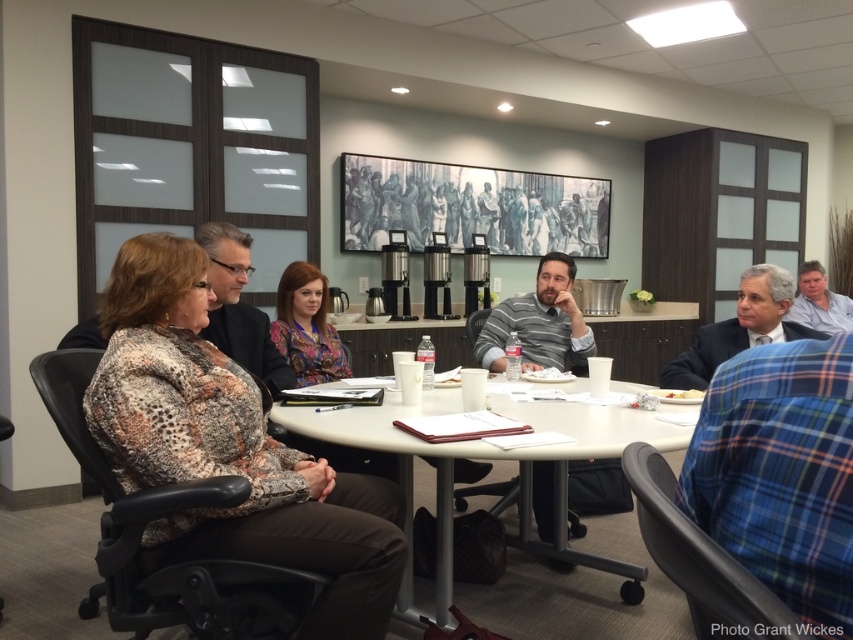
Question: Can you confirm if printed fabric blouse at left is smaller than gray striped shirt at center?

Choices:
 (A) no
 (B) yes

Answer: (A)

Question: In this image, where is printed fabric blouse at left located relative to dark gray suit at right?

Choices:
 (A) left
 (B) right

Answer: (A)

Question: Which of these objects is positioned closest to the printed fabric blouse at left?

Choices:
 (A) gray striped shirt at center
 (B) dark gray suit at right

Answer: (A)

Question: Which of the following is the farthest from the observer?

Choices:
 (A) dark gray suit at right
 (B) blue shirt at right
 (C) gray striped shirt at center

Answer: (B)

Question: Is white plastic table at center closer to the viewer compared to gray striped shirt at center?

Choices:
 (A) yes
 (B) no

Answer: (A)

Question: Which of these objects is positioned closest to the printed fabric blouse at left?

Choices:
 (A) gray striped shirt at center
 (B) dark gray suit at right
 (C) blue shirt at right

Answer: (A)